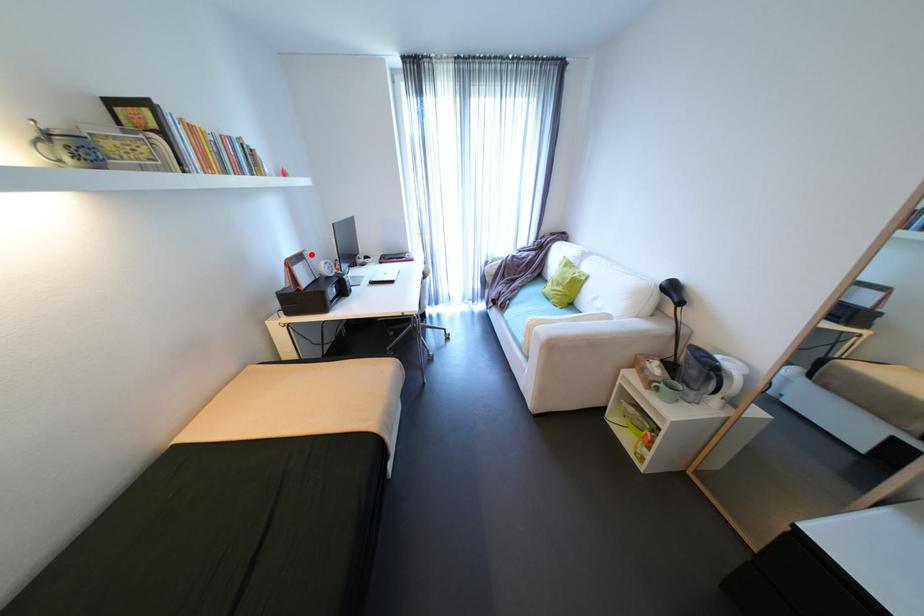
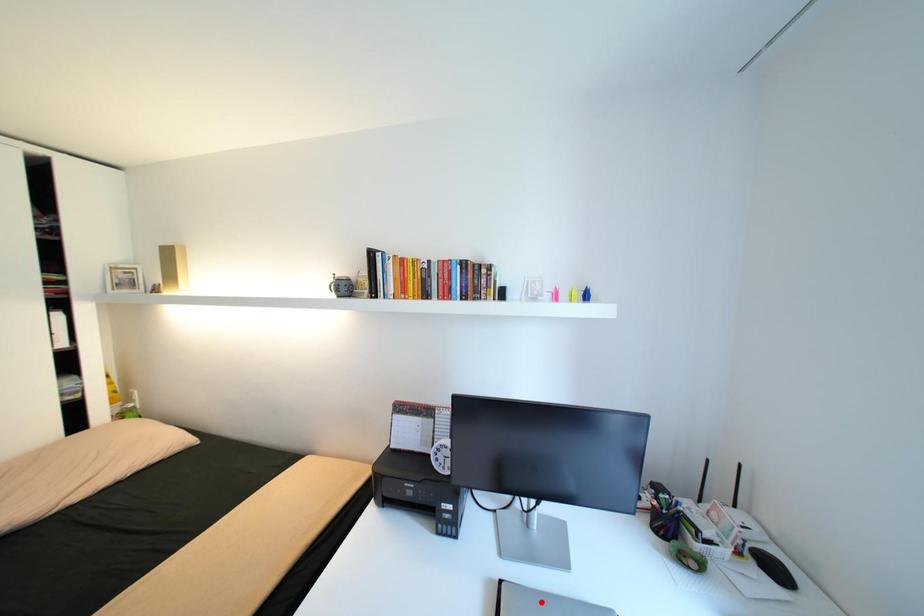
I am providing you with two images of the same scene from different viewpoints. A red point is marked on the first image and another point is marked on the second image. Does the point marked in image1 correspond to the same location as the one in image2?

No